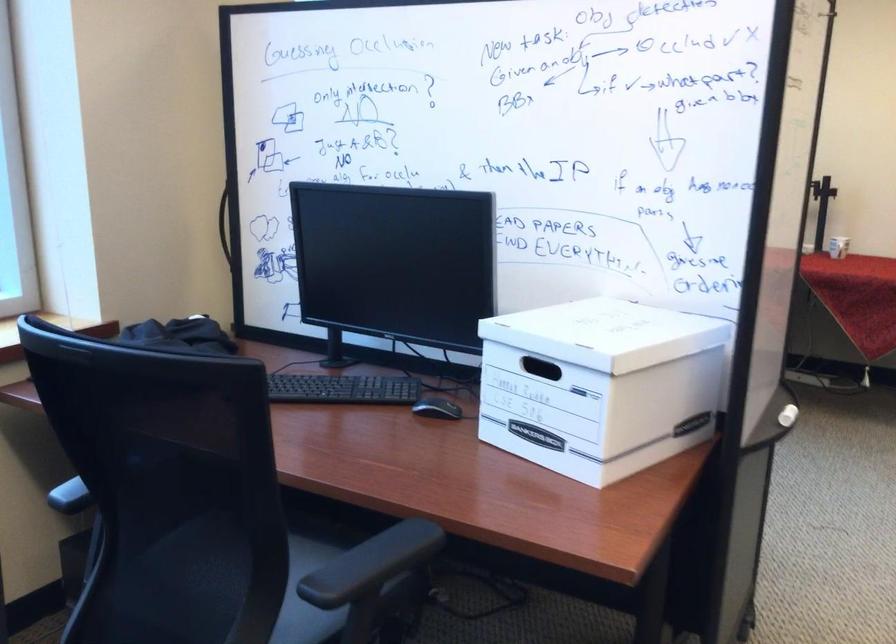
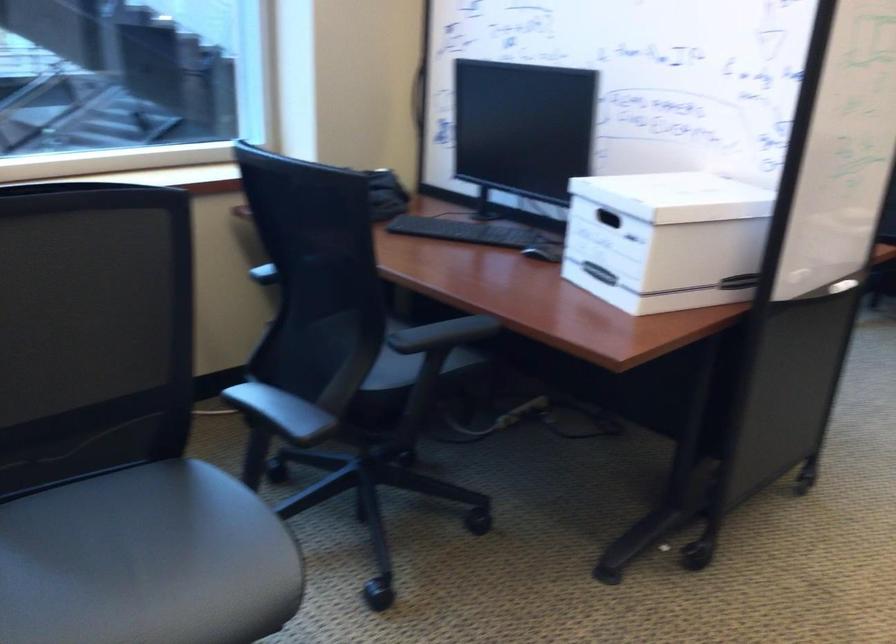
The point at (374, 562) is marked in the first image. Where is the corresponding point in the second image?

(442, 334)